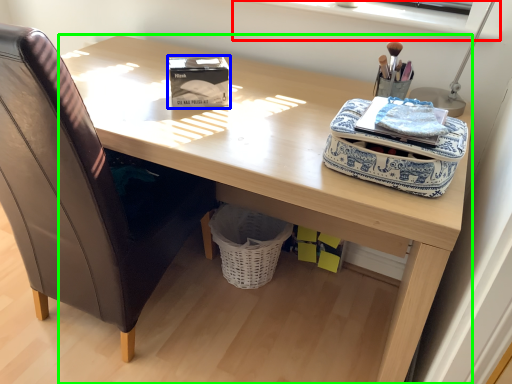
Question: Based on their relative distances, which object is nearer to window sill (highlighted by a red box)? Choose from box (highlighted by a blue box) and desk (highlighted by a green box).

Choices:
 (A) box
 (B) desk

Answer: (B)